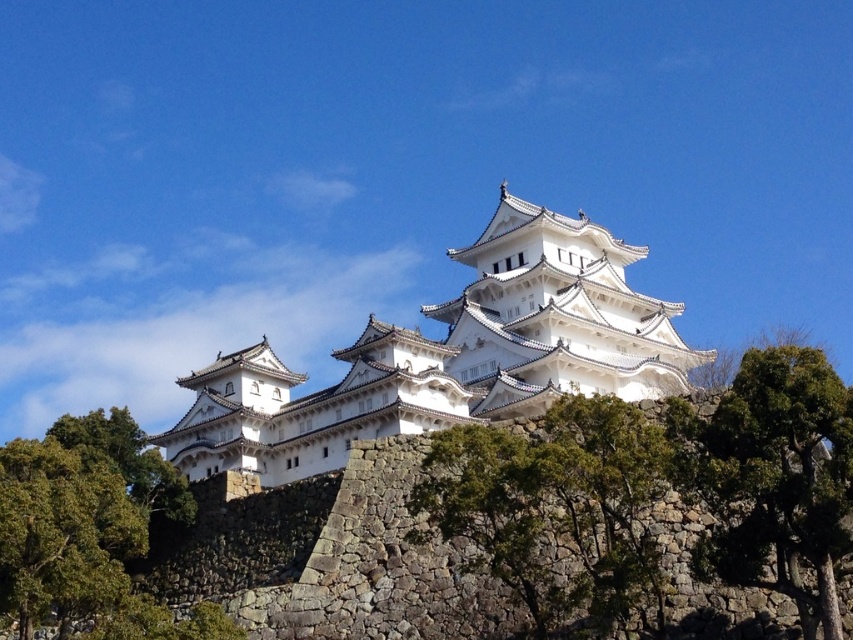
Question: Which is nearer to the green leafy tree at center?

Choices:
 (A) white stone castle at center
 (B) green leafy tree at lower left
 (C) green leafy tree at lower center

Answer: (C)

Question: Is white stone castle at center above green leafy tree at lower left?

Choices:
 (A) no
 (B) yes

Answer: (B)

Question: Which object is the closest to the green leafy tree at center?

Choices:
 (A) green leafy tree at lower center
 (B) green leafy tree at lower left
 (C) white stone castle at center

Answer: (A)

Question: Does green leafy tree at center appear over green leafy tree at lower left?

Choices:
 (A) yes
 (B) no

Answer: (A)

Question: Does green leafy tree at center lie behind green leafy tree at lower left?

Choices:
 (A) no
 (B) yes

Answer: (A)

Question: Among these objects, which one is nearest to the camera?

Choices:
 (A) green leafy tree at center
 (B) green leafy tree at lower center
 (C) green leafy tree at lower left

Answer: (A)